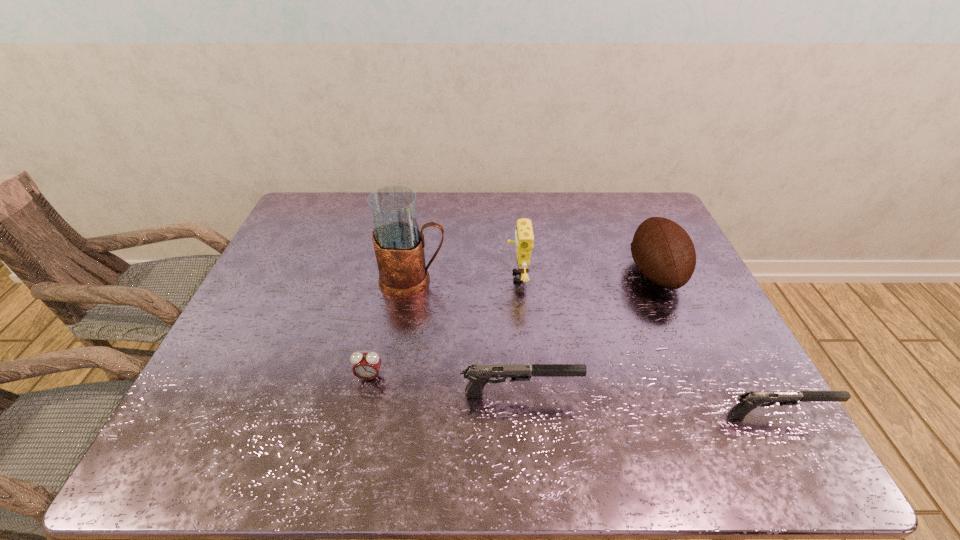
Locate an element on the screen. This screenshot has width=960, height=540. free point between the fourth farthest object and the football is located at coordinates (513, 325).

At what (x,y) coordinates should I click in order to perform the action: click on free space between the pitcher and the third nearest object. Please return your answer as a coordinate pair (x, y). Looking at the image, I should click on (391, 328).

I want to click on empty space between the fourth farthest object and the shorter gun, so click(x=573, y=396).

Find the location of a particular element. object that is the fourth nearest to the farther gun is located at coordinates (749, 400).

Locate an element on the screen. This screenshot has width=960, height=540. object that is the fourth nearest to the sponge is located at coordinates (366, 366).

Identify the location of free spot that satisfies the following two spatial constraints: 1. on the face of the sponge; 2. on the clock face of the alarm clock. The height and width of the screenshot is (540, 960). (526, 377).

You are a GUI agent. You are given a task and a screenshot of the screen. Output one action in this format:
    pyautogui.click(x=<x>, y=<y>)
    Task: Click on the blank space that satisfies the following two spatial constraints: 1. on the laces of the football; 2. on the clock face of the alarm clock
    This screenshot has height=540, width=960.
    Given the screenshot: What is the action you would take?
    pyautogui.click(x=702, y=377)

The width and height of the screenshot is (960, 540). In order to click on vacant space that satisfies the following two spatial constraints: 1. on the laces of the football; 2. on the clock face of the fourth farthest object in this screenshot , I will do `click(702, 377)`.

Locate an element on the screen. This screenshot has height=540, width=960. blank space that satisfies the following two spatial constraints: 1. with the handle on the side of the tallest object; 2. on the clock face of the alarm clock is located at coordinates (396, 377).